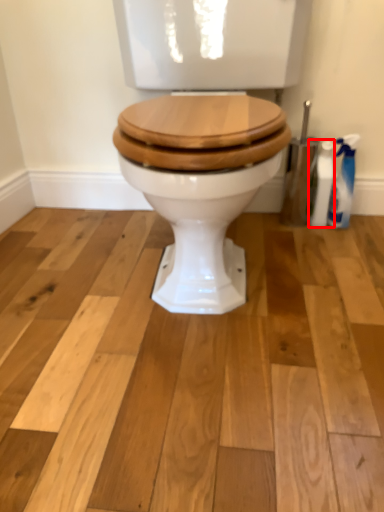
Question: From the image's perspective, where is cleaning product (annotated by the red box) located relative to cleaning product?

Choices:
 (A) below
 (B) above

Answer: (A)